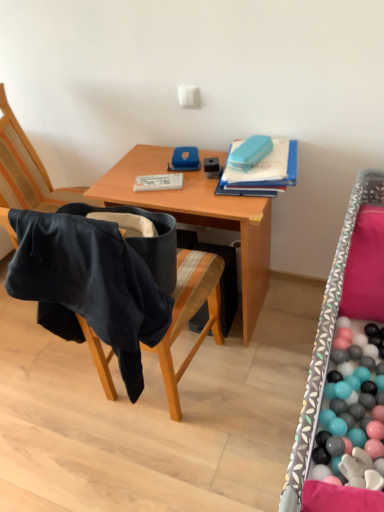
I want to click on vacant area that is in front of wooden desk at center, so click(228, 410).